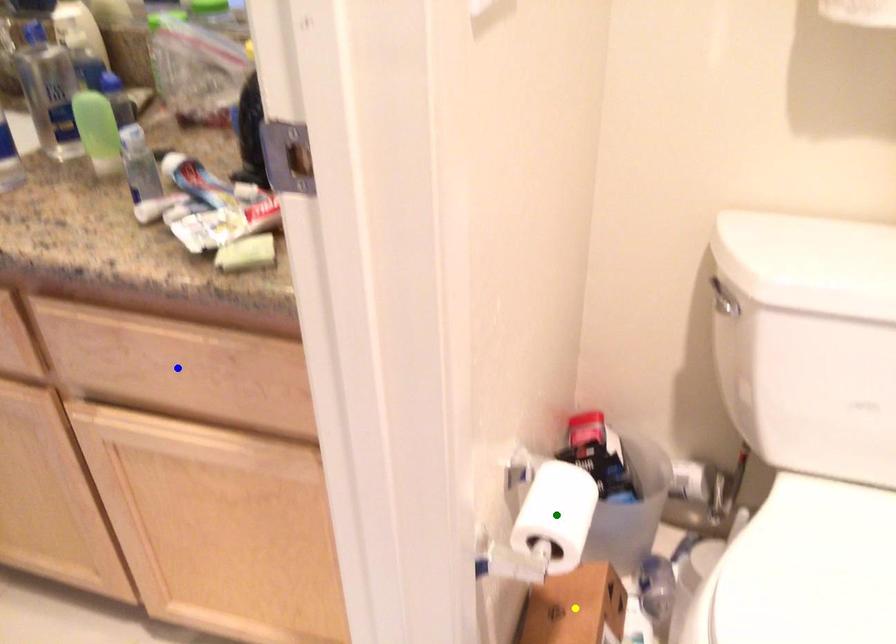
Order these from farthest to nearest:
green point
yellow point
blue point

yellow point
blue point
green point